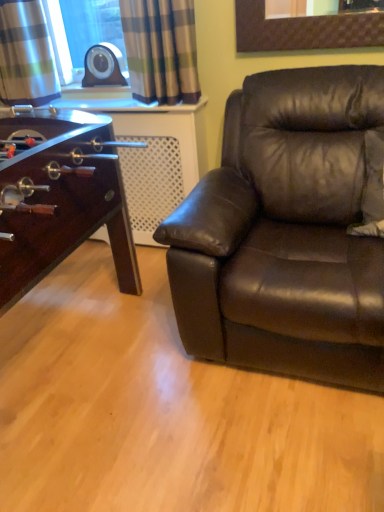
Question: Considering the relative positions of plaid fabric curtain at upper left, positioned as the second curtain in left-to-right order, and brown leather couch at right in the image provided, is plaid fabric curtain at upper left, positioned as the second curtain in left-to-right order, to the right of brown leather couch at right from the viewer's perspective?

Choices:
 (A) yes
 (B) no

Answer: (B)

Question: Is plaid fabric curtain at upper left, acting as the 1th curtain starting from the right, positioned far away from brown leather couch at right?

Choices:
 (A) no
 (B) yes

Answer: (A)

Question: Considering the relative sizes of plaid fabric curtain at upper left, positioned as the second curtain in left-to-right order, and brown leather couch at right in the image provided, is plaid fabric curtain at upper left, positioned as the second curtain in left-to-right order, bigger than brown leather couch at right?

Choices:
 (A) no
 (B) yes

Answer: (A)

Question: Does plaid fabric curtain at upper left, acting as the 1th curtain starting from the right, come behind brown leather couch at right?

Choices:
 (A) yes
 (B) no

Answer: (A)

Question: Can you confirm if plaid fabric curtain at upper left, positioned as the second curtain in left-to-right order, is taller than brown leather couch at right?

Choices:
 (A) yes
 (B) no

Answer: (B)

Question: Is plaid fabric curtain at upper left, acting as the 1th curtain starting from the right, in front of brown leather couch at right?

Choices:
 (A) yes
 (B) no

Answer: (B)

Question: From the image's perspective, is plaid fabric curtain at upper left, which is counted as the 1th curtain, starting from the left, below plaid fabric curtain at upper left, positioned as the second curtain in left-to-right order?

Choices:
 (A) yes
 (B) no

Answer: (B)

Question: Can you confirm if plaid fabric curtain at upper left, which is counted as the 1th curtain, starting from the left, is thinner than plaid fabric curtain at upper left, acting as the 1th curtain starting from the right?

Choices:
 (A) yes
 (B) no

Answer: (B)

Question: Does plaid fabric curtain at upper left, which is counted as the 1th curtain, starting from the left, appear on the left side of plaid fabric curtain at upper left, positioned as the second curtain in left-to-right order?

Choices:
 (A) yes
 (B) no

Answer: (A)

Question: From a real-world perspective, does plaid fabric curtain at upper left, which is counted as the 1th curtain, starting from the left, sit lower than plaid fabric curtain at upper left, positioned as the second curtain in left-to-right order?

Choices:
 (A) no
 (B) yes

Answer: (A)

Question: Is plaid fabric curtain at upper left, the 2th curtain from the right, outside of plaid fabric curtain at upper left, positioned as the second curtain in left-to-right order?

Choices:
 (A) yes
 (B) no

Answer: (A)

Question: Considering the relative sizes of plaid fabric curtain at upper left, which is counted as the 1th curtain, starting from the left, and plaid fabric curtain at upper left, acting as the 1th curtain starting from the right, in the image provided, is plaid fabric curtain at upper left, which is counted as the 1th curtain, starting from the left, smaller than plaid fabric curtain at upper left, acting as the 1th curtain starting from the right,?

Choices:
 (A) yes
 (B) no

Answer: (B)

Question: From the image's perspective, is brown leather couch at right below plaid fabric curtain at upper left, the 2th curtain from the right?

Choices:
 (A) yes
 (B) no

Answer: (A)